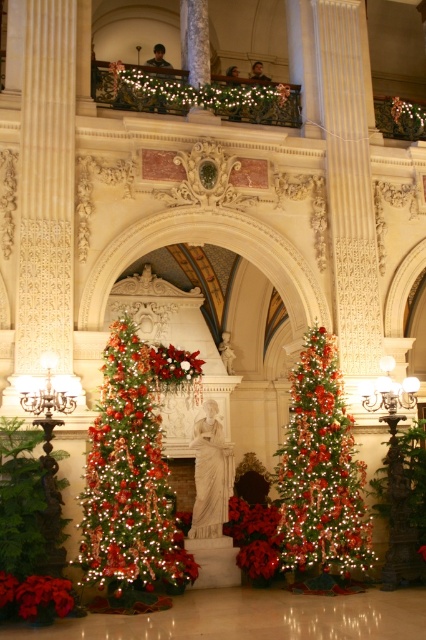
Does shiny green christmas tree at left lie in front of green shiny christmas tree at center?

Yes, it is.

At what (x,y) coordinates should I click in order to perform the action: click on shiny green christmas tree at left. Please return your answer as a coordinate pair (x, y). Looking at the image, I should click on (129, 483).

You are a GUI agent. You are given a task and a screenshot of the screen. Output one action in this format:
    pyautogui.click(x=<x>, y=<y>)
    Task: Click on the shiny green christmas tree at left
    The image size is (426, 640).
    Given the screenshot: What is the action you would take?
    pyautogui.click(x=129, y=483)